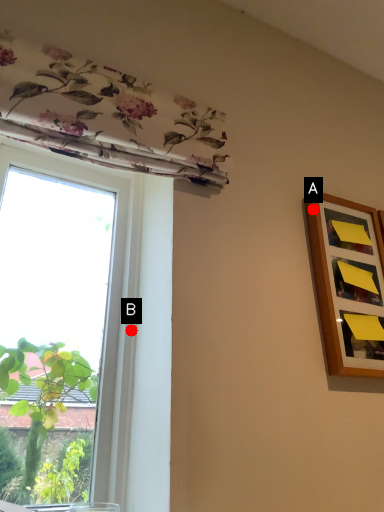
Question: Two points are circled on the image, labeled by A and B beside each circle. Which point appears closest to the camera in this image?

Choices:
 (A) A is closer
 (B) B is closer

Answer: (B)